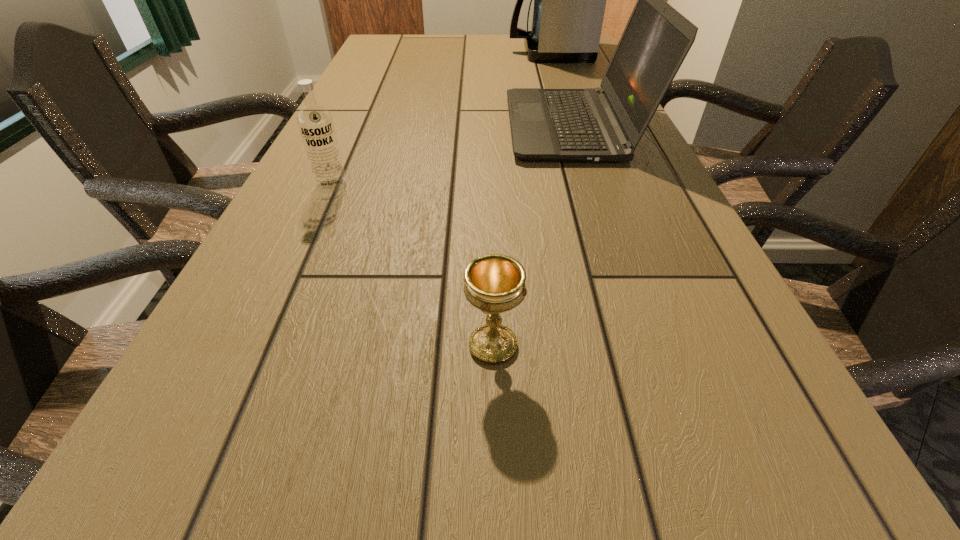
At what (x,y) coordinates should I click in order to perform the action: click on coffee maker. Please return your answer as a coordinate pair (x, y). The image size is (960, 540). Looking at the image, I should click on pos(569,0).

Locate an element on the screen. the farthest object is located at coordinates (569, 0).

The width and height of the screenshot is (960, 540). Find the location of `the third shortest object`. the third shortest object is located at coordinates (605, 124).

The image size is (960, 540). What are the coordinates of `the third nearest object` in the screenshot? It's located at (605, 124).

Find the location of a particular element. The height and width of the screenshot is (540, 960). the second nearest object is located at coordinates (315, 122).

Where is `the leftmost object`? the leftmost object is located at coordinates (315, 122).

Find the location of a particular element. Image resolution: width=960 pixels, height=540 pixels. the shortest object is located at coordinates (494, 283).

Find the location of `the second object from left to right`. the second object from left to right is located at coordinates (494, 283).

Locate an element on the screen. The width and height of the screenshot is (960, 540). free region located 0.070m on the front panel of the tallest object is located at coordinates (488, 52).

The height and width of the screenshot is (540, 960). What are the coordinates of `free space located on the front panel of the tallest object` in the screenshot? It's located at (404, 52).